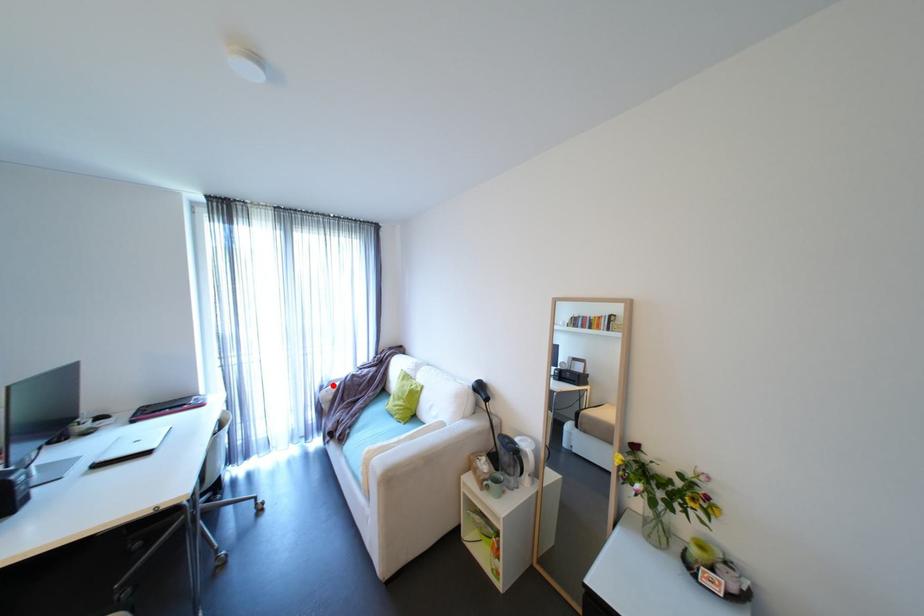
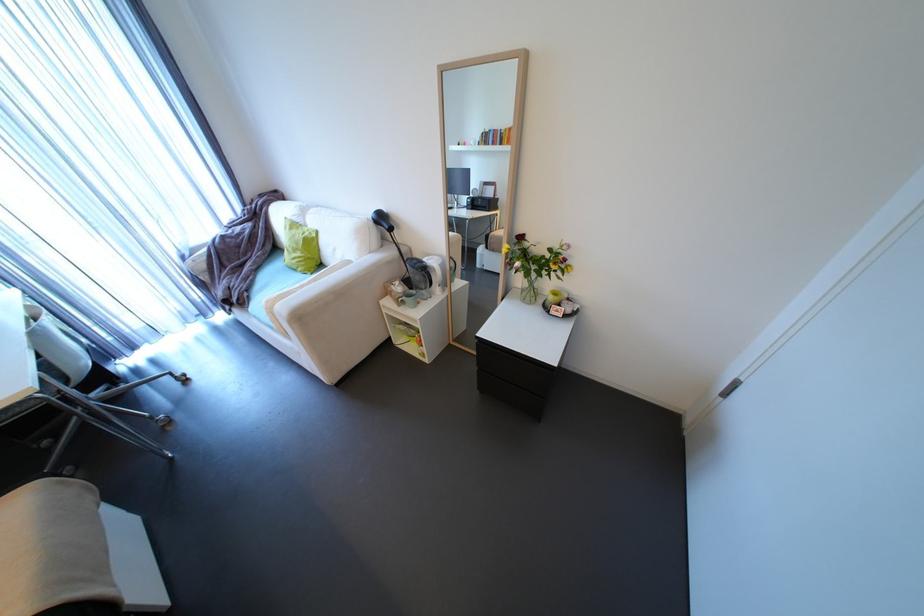
Question: I am providing you with two images of the same scene from different viewpoints. In image1, a red point is highlighted. Considering the same 3D point in image2, which of the following is correct?

Choices:
 (A) It is closer
 (B) It is farther

Answer: (A)